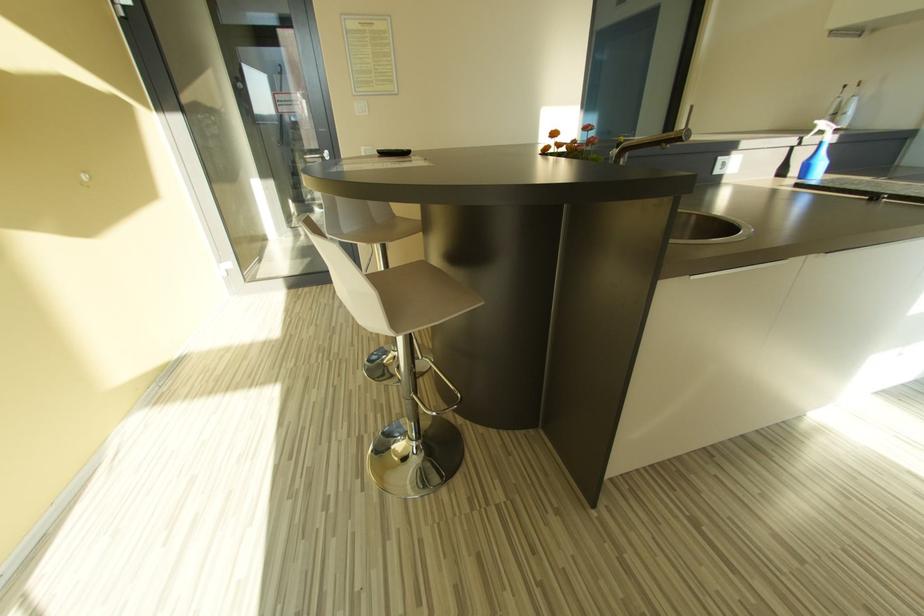
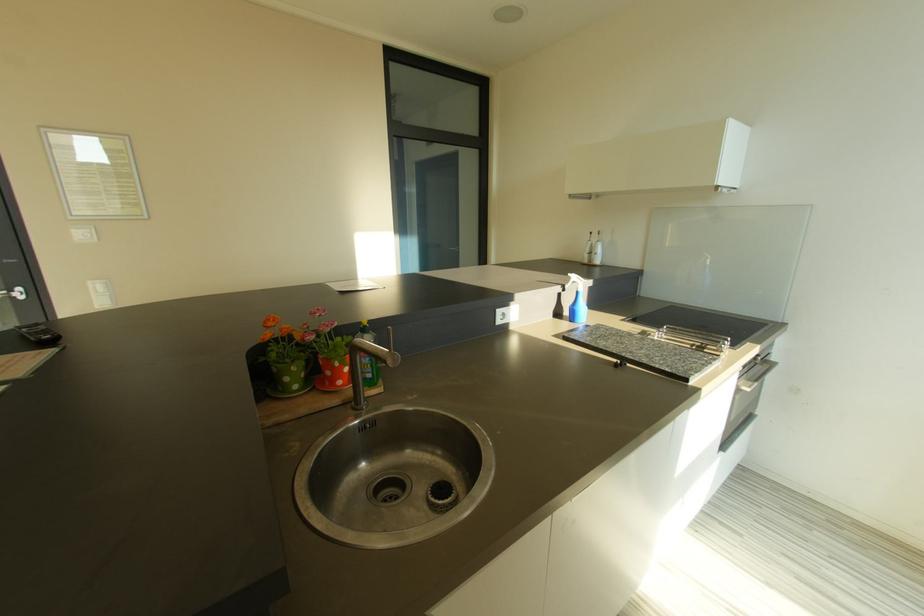
Question: The first image is from the beginning of the video and the second image is from the end. How did the camera likely rotate when shooting the video?

Choices:
 (A) Left
 (B) Right
 (C) Up
 (D) Down

Answer: (B)